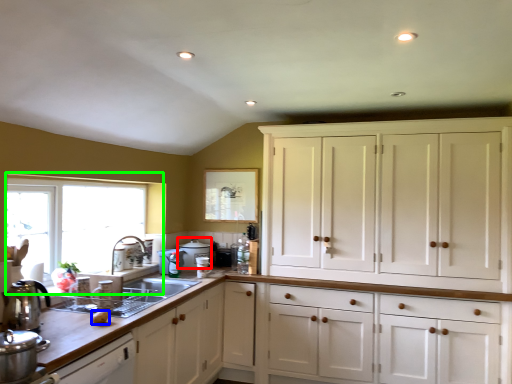
Question: Estimate the real-world distances between objects in this image. Which object is farther from appliance (highlighted by a red box), food (highlighted by a blue box) or window (highlighted by a green box)?

Choices:
 (A) food
 (B) window

Answer: (A)